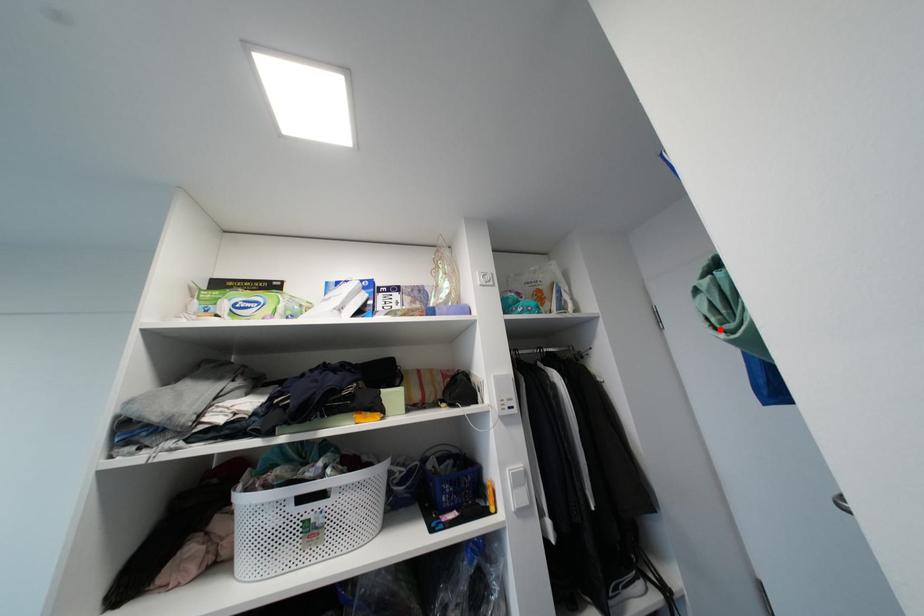
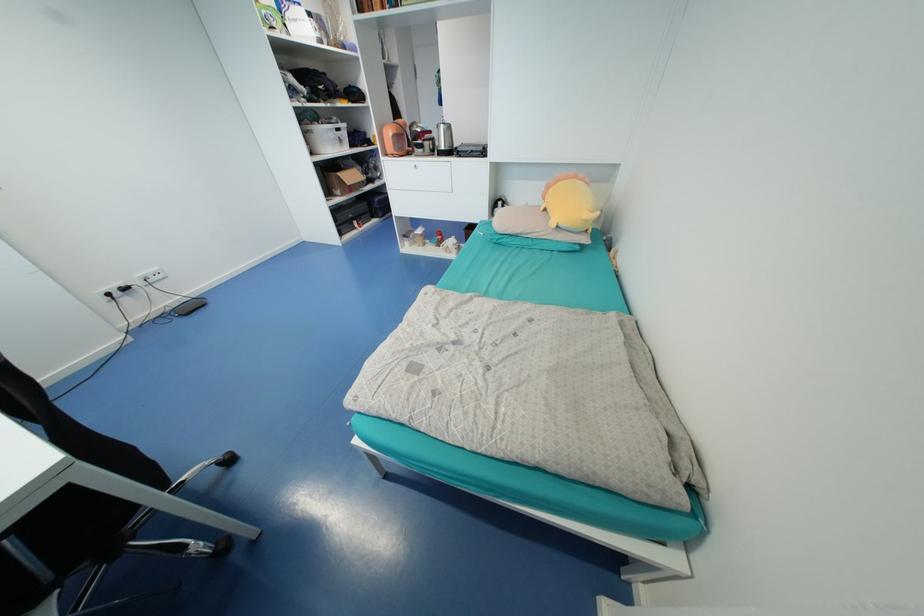
Question: I am providing you with two images of the same scene from different viewpoints. A red point is marked on the first image. At the location where the point appears in image 1, is it still visible in image 2?

Choices:
 (A) Yes
 (B) No

Answer: (B)